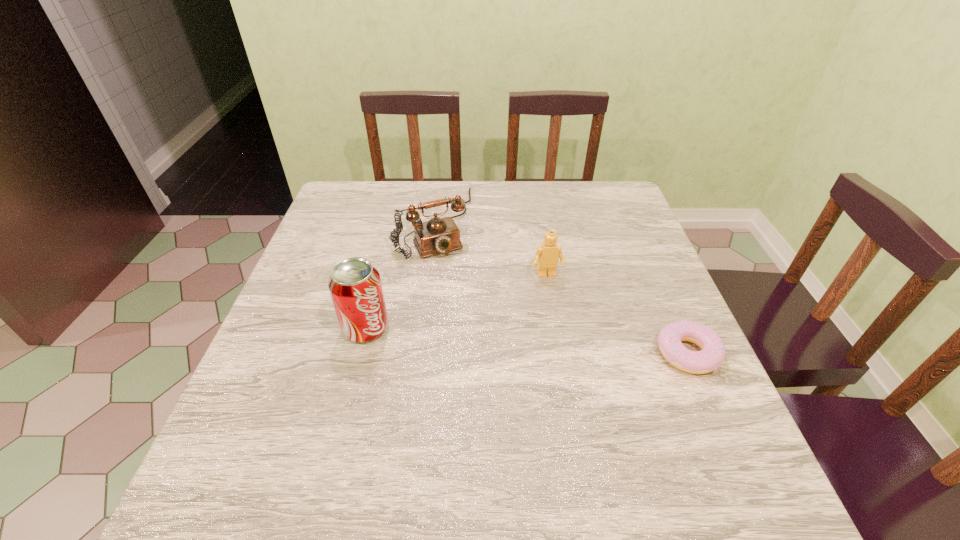
Identify the location of unoccupied area between the Lego and the shortest object. This screenshot has height=540, width=960. (617, 315).

The image size is (960, 540). What are the coordinates of `free spot between the shortest object and the Lego` in the screenshot? It's located at (617, 315).

Locate an element on the screen. unoccupied position between the rightmost object and the soda can is located at coordinates (527, 341).

Find the location of `empty space between the soda can and the rightmost object`. empty space between the soda can and the rightmost object is located at coordinates (527, 341).

Identify which object is the closest to the doughnut. Please provide its 2D coordinates. Your answer should be formatted as a tuple, i.e. [(x, y)], where the tuple contains the x and y coordinates of a point satisfying the conditions above.

[(547, 256)]

Find the location of a particular element. Image resolution: width=960 pixels, height=540 pixels. object that can be found as the second closest to the soda can is located at coordinates (547, 256).

Locate an element on the screen. The width and height of the screenshot is (960, 540). free space that satisfies the following two spatial constraints: 1. on the front side of the telephone; 2. on the right side of the third object from left to right is located at coordinates (427, 276).

At what (x,y) coordinates should I click in order to perform the action: click on free space in the image that satisfies the following two spatial constraints: 1. on the back side of the soda can; 2. on the right side of the telephone. Please return your answer as a coordinate pair (x, y). Looking at the image, I should click on (x=393, y=222).